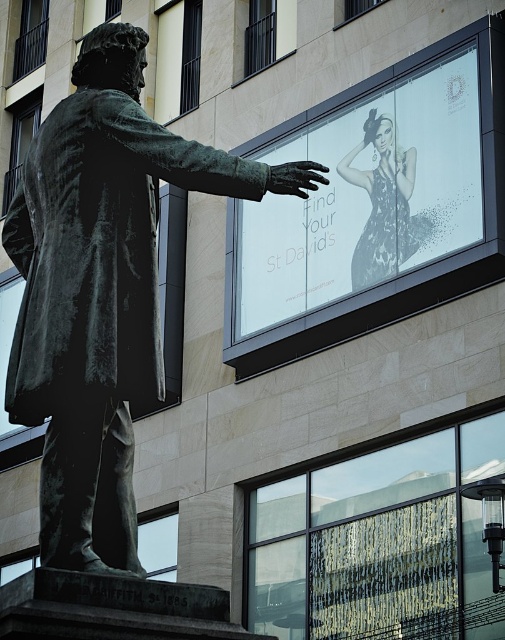
You are an art student analyzing the scene. You notice the white glossy poster at upper center and the shiny silver dress at upper center. Which object is bigger?

The white glossy poster at upper center is larger in size than the shiny silver dress at upper center.

You are an art student analyzing the image. You notice the bronze statue of a man on the left and the white glossy poster at upper center. Based on their positions, which object is closer to the center of the image?

The white glossy poster at upper center is closer to the center of the image because it is located at point (x=367, y=195), which is nearer to the center coordinates compared to the bronze statue of a man on the left.